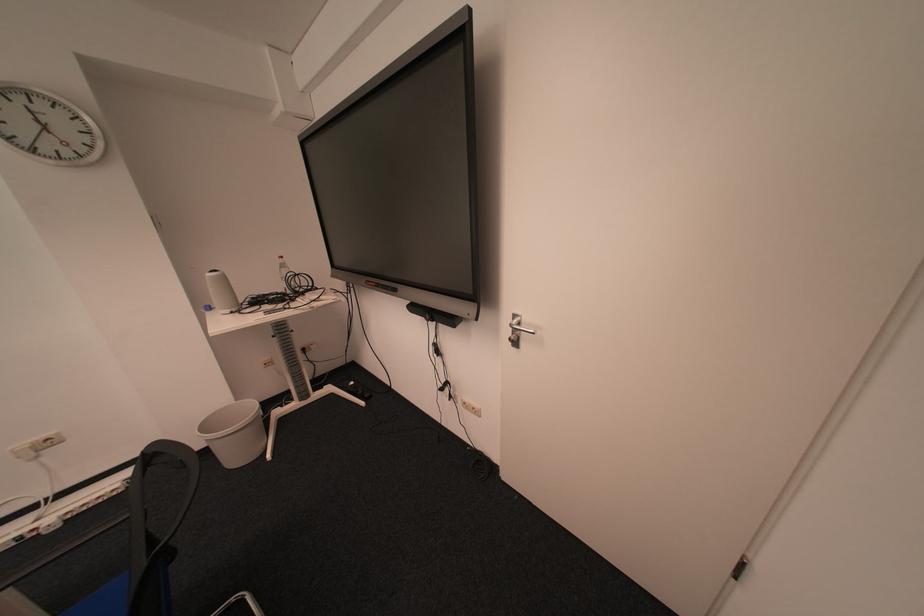
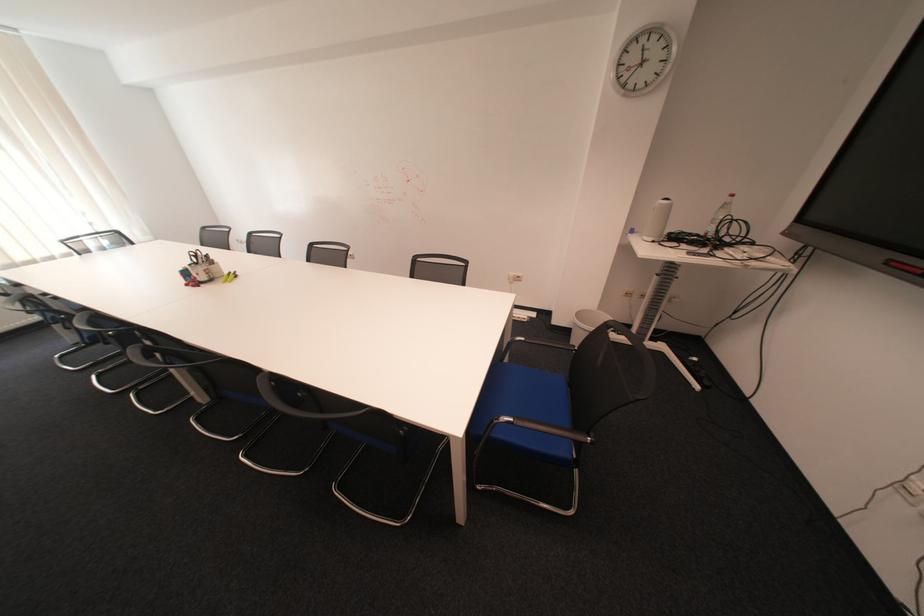
Looking at this image, first-person continuous shooting, in which direction is the camera rotating?

The camera's rotation is toward left-down.